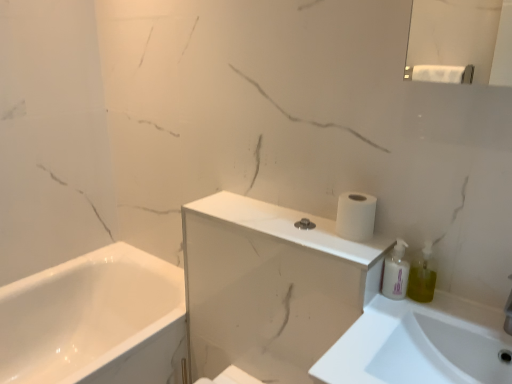
Find the location of a particular element. free space to the left of white matte toilet paper at upper right is located at coordinates (301, 228).